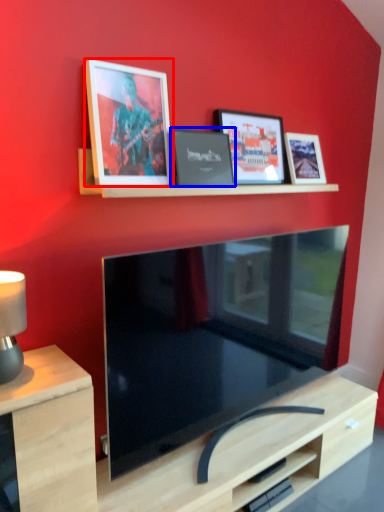
Question: Which of the following is the closest to the observer, picture frame (highlighted by a red box) or picture frame (highlighted by a blue box)?

Choices:
 (A) picture frame
 (B) picture frame

Answer: (A)